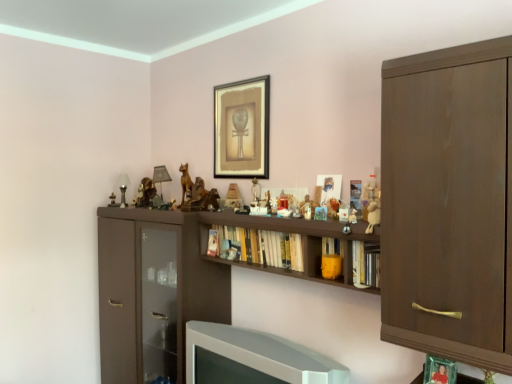
Question: Considering the relative positions of hardcover books at center, the third book from the front, and dark brown wood cabinet at right in the image provided, is hardcover books at center, the third book from the front, to the right of dark brown wood cabinet at right from the viewer's perspective?

Choices:
 (A) no
 (B) yes

Answer: (A)

Question: From the image's perspective, would you say hardcover books at center, the first book positioned from the back, is positioned over dark brown wood cabinet at right?

Choices:
 (A) no
 (B) yes

Answer: (A)

Question: From a real-world perspective, is hardcover books at center, the first book positioned from the back, on dark brown wood cabinet at right?

Choices:
 (A) yes
 (B) no

Answer: (B)

Question: Is hardcover books at center, the first book positioned from the back, completely or partially outside of dark brown wood cabinet at right?

Choices:
 (A) no
 (B) yes

Answer: (B)

Question: Considering the relative sizes of hardcover books at center, marked as the first book in a left-to-right arrangement, and dark brown wood cabinet at right in the image provided, is hardcover books at center, marked as the first book in a left-to-right arrangement, shorter than dark brown wood cabinet at right?

Choices:
 (A) no
 (B) yes

Answer: (B)

Question: From the image's perspective, is yellow matte bookshelf at center, which is counted as the 2th book, starting from the left, located above or below white glossy television at lower center?

Choices:
 (A) above
 (B) below

Answer: (A)

Question: From a real-world perspective, is yellow matte bookshelf at center, which is counted as the 2th book, starting from the left, positioned above or below white glossy television at lower center?

Choices:
 (A) below
 (B) above

Answer: (B)

Question: In terms of width, does yellow matte bookshelf at center, acting as the second book starting from the front, look wider or thinner when compared to white glossy television at lower center?

Choices:
 (A) wide
 (B) thin

Answer: (B)

Question: Considering the positions of yellow matte bookshelf at center, marked as the 2th book in a back-to-front arrangement, and white glossy television at lower center in the image, is yellow matte bookshelf at center, marked as the 2th book in a back-to-front arrangement, taller or shorter than white glossy television at lower center?

Choices:
 (A) short
 (B) tall

Answer: (A)

Question: From a real-world perspective, relative to hardcover books at center, the first book positioned from the back, is wooden figurine at center, placed as the 3th toy when sorted from back to front, vertically above or below?

Choices:
 (A) above
 (B) below

Answer: (A)

Question: Is wooden figurine at center, which is the second toy in front-to-back order, to the left or to the right of hardcover books at center, the 3th book positioned from the right, in the image?

Choices:
 (A) right
 (B) left

Answer: (A)

Question: In terms of width, does wooden figurine at center, the 2th toy positioned from the right, look wider or thinner when compared to hardcover books at center, marked as the first book in a left-to-right arrangement?

Choices:
 (A) wide
 (B) thin

Answer: (B)

Question: Is wooden figurine at center, the 2th toy positioned from the right, taller or shorter than hardcover books at center, marked as the first book in a left-to-right arrangement?

Choices:
 (A) short
 (B) tall

Answer: (A)

Question: Based on their positions, is matte wooden figurine at center, which ranks as the third toy in right-to-left order, located to the left or right of metallic figurine at left, which is counted as the 1th toy, starting from the left?

Choices:
 (A) right
 (B) left

Answer: (A)

Question: In terms of height, does matte wooden figurine at center, the third toy when ordered from front to back, look taller or shorter compared to metallic figurine at left, which is the fourth toy in right-to-left order?

Choices:
 (A) short
 (B) tall

Answer: (B)